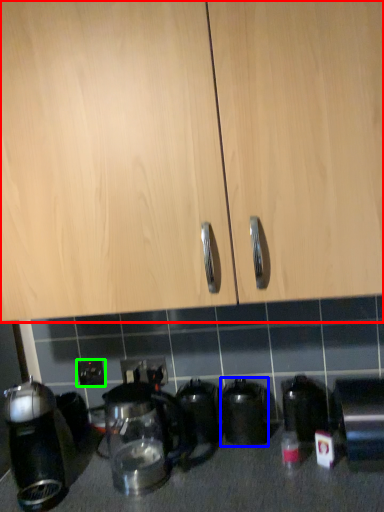
Question: Which object is positioned closest to cabinetry (highlighted by a red box)? Select from kitchen appliance (highlighted by a blue box) and electric outlet (highlighted by a green box).

Choices:
 (A) kitchen appliance
 (B) electric outlet

Answer: (A)